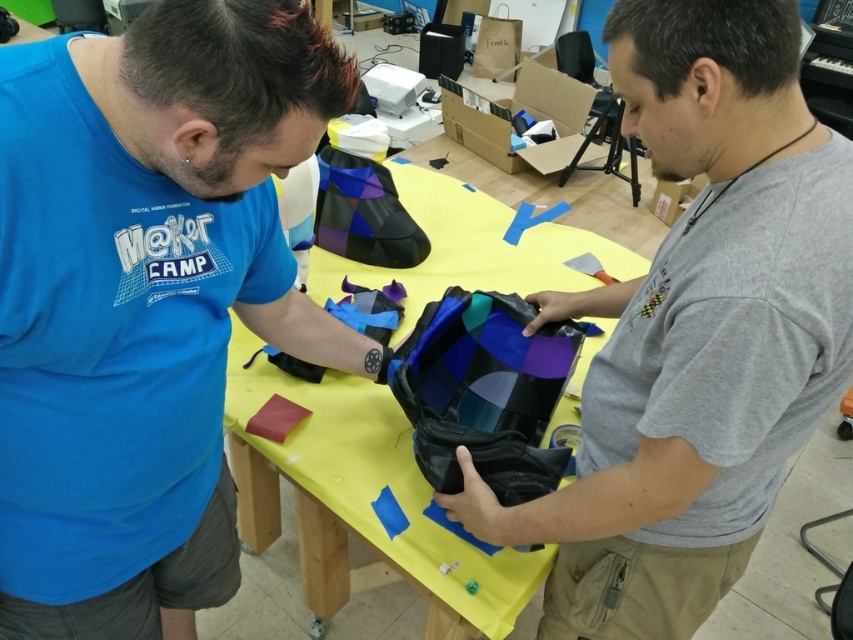
Can you confirm if matte black bag at center is bigger than yellow fabric table at center?

Actually, matte black bag at center might be smaller than yellow fabric table at center.

Which is in front, point (837, 208) or point (231, 433)?

Point (837, 208)

Locate an element on the screen. matte black bag at center is located at coordinates (695, 330).

Looking at this image, between matte blue shirt at left and matte black bag at center, which one is positioned lower?

Positioned lower is matte blue shirt at left.

Between matte blue shirt at left and matte black bag at center, which one is positioned higher?

matte black bag at center

Locate an element on the screen. The image size is (853, 640). matte blue shirt at left is located at coordinates [144, 300].

Does matte blue shirt at left appear under yellow fabric table at center?

Yes.

Does point (173, 84) lie in front of point (386, 452)?

Yes.

I want to click on matte blue shirt at left, so click(x=144, y=300).